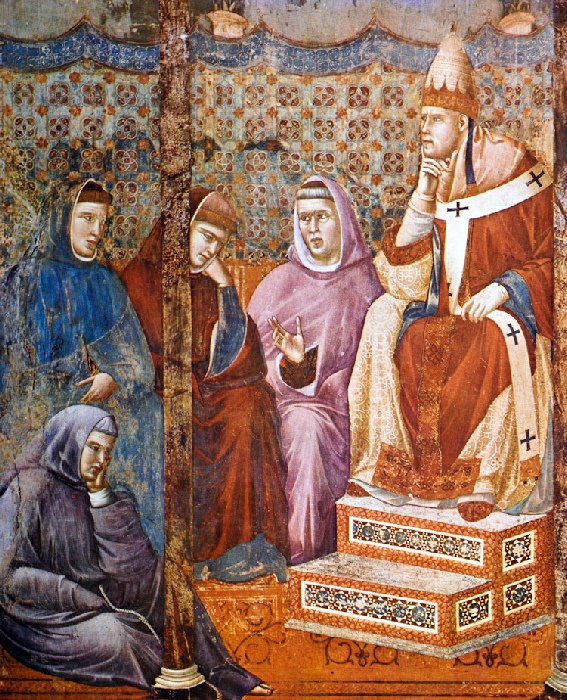
Locate an element on the screen. This screenshot has width=567, height=700. burgundy robe is located at coordinates (147, 297).